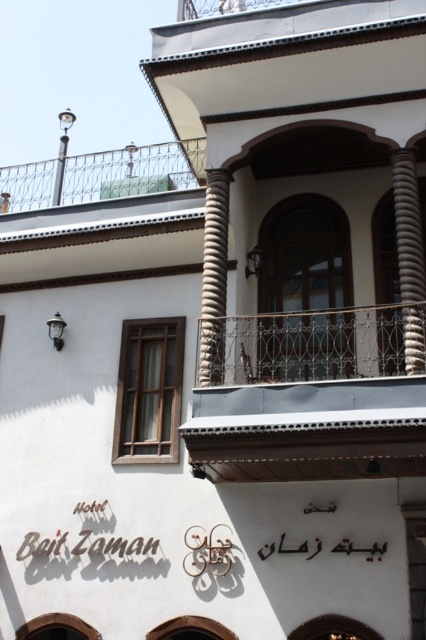
You are standing in front of the building and notice two points marked on the facade. The first point is at coordinate point(192,394) and the second is at point(400,244). Which point is closer to you?

Point(192,394) is in front of point(400,244), so it is closer to you.